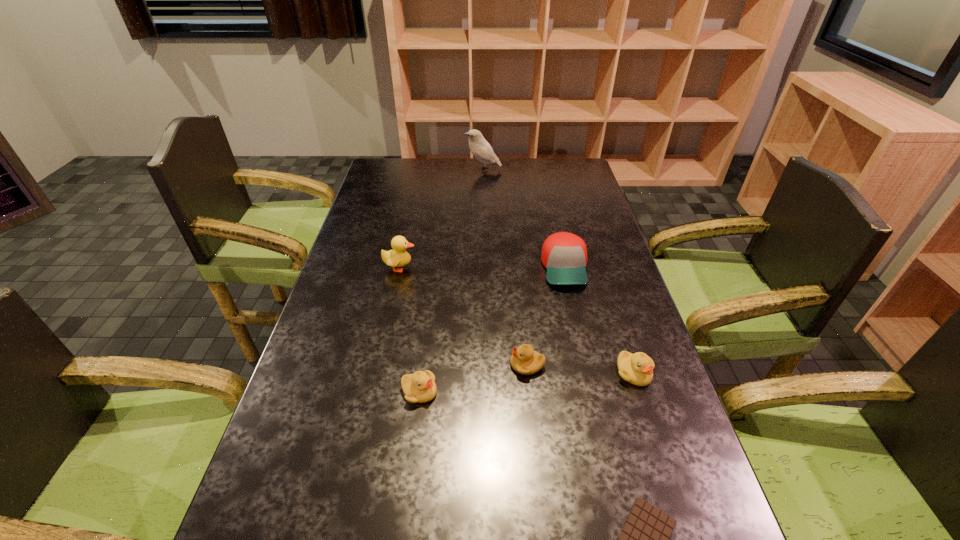
Where is `free space that satisfies the following two spatial constraints: 1. at the brim of the baseball cap; 2. on the front-facing side of the third duckling from left to right`? Image resolution: width=960 pixels, height=540 pixels. free space that satisfies the following two spatial constraints: 1. at the brim of the baseball cap; 2. on the front-facing side of the third duckling from left to right is located at coordinates (587, 365).